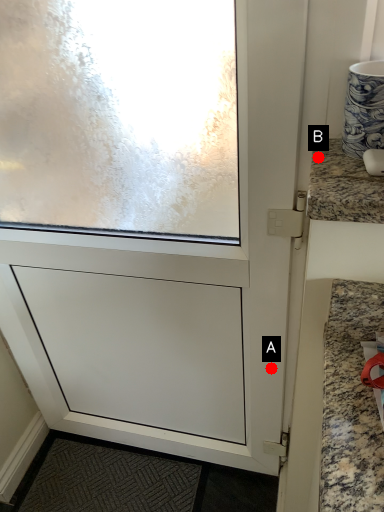
Question: Two points are circled on the image, labeled by A and B beside each circle. Which point appears farthest from the camera in this image?

Choices:
 (A) A is further
 (B) B is further

Answer: (A)